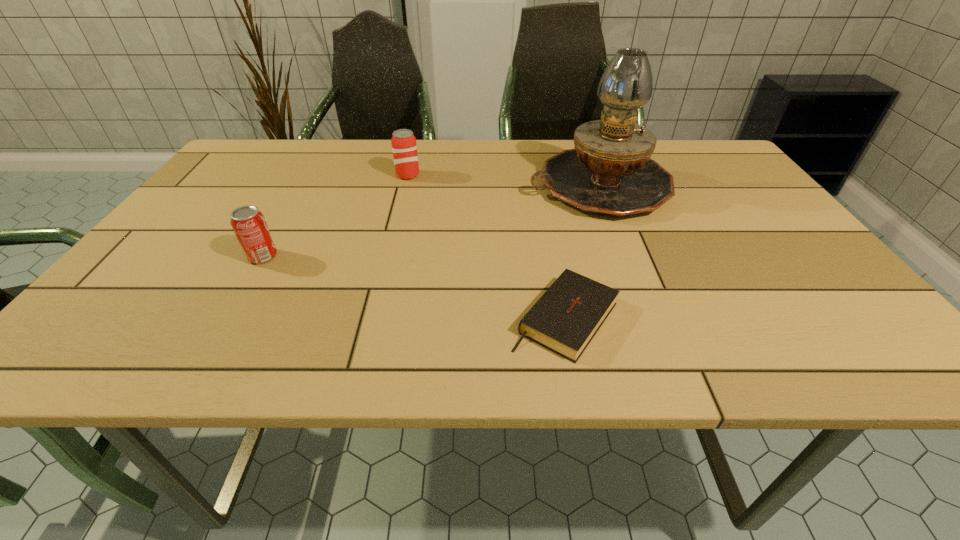
The width and height of the screenshot is (960, 540). What are the coordinates of `oil lamp that is positioned at the far edge` in the screenshot? It's located at (609, 172).

This screenshot has width=960, height=540. Identify the location of beer can that is at the far edge. (404, 147).

Image resolution: width=960 pixels, height=540 pixels. In order to click on object at the near edge in this screenshot , I will do `click(565, 319)`.

The image size is (960, 540). Find the location of `free space at the far edge of the desktop`. free space at the far edge of the desktop is located at coordinates (420, 153).

In order to click on free space at the near edge of the desktop in this screenshot , I will do `click(517, 336)`.

This screenshot has height=540, width=960. In the image, there is a desktop. What are the coordinates of `vacant space at the left edge` in the screenshot? It's located at click(x=197, y=290).

Identify the location of free space at the far left corner of the desktop. The image size is (960, 540). (244, 146).

Where is `vacant area at the far right corner of the desktop`? Image resolution: width=960 pixels, height=540 pixels. vacant area at the far right corner of the desktop is located at coordinates (704, 143).

At what (x,y) coordinates should I click in order to perform the action: click on vacant area that lies between the beer can and the second nearest object. Please return your answer as a coordinate pair (x, y). Looking at the image, I should click on (335, 216).

This screenshot has width=960, height=540. I want to click on vacant area between the oil lamp and the beer can, so click(x=503, y=181).